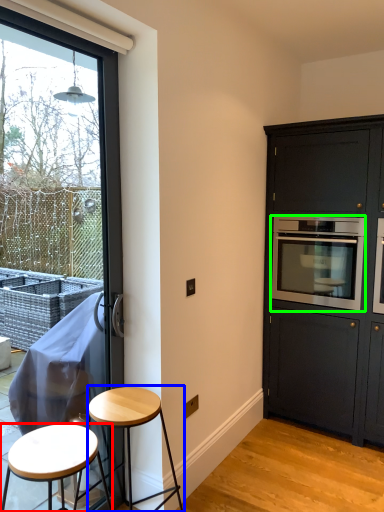
Question: Which object is the closest to the stool (highlighted by a red box)? Choose among these: stool (highlighted by a blue box) or oven (highlighted by a green box).

Choices:
 (A) stool
 (B) oven

Answer: (A)